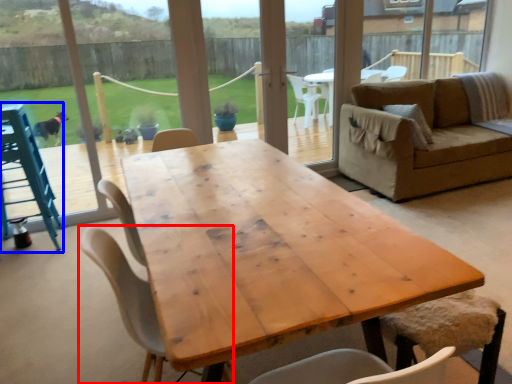
Question: Among these objects, which one is nearest to the camera, chair (highlighted by a red box) or feeding chair (highlighted by a blue box)?

Choices:
 (A) chair
 (B) feeding chair

Answer: (A)